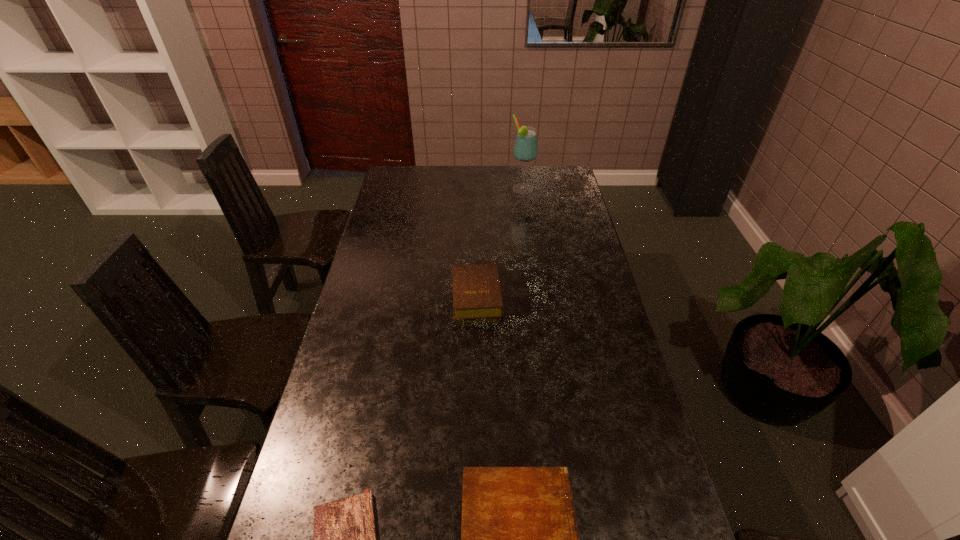
At what (x,y) coordinates should I click in order to perform the action: click on vacant area that lies between the tallest Bible and the farthest object. Please return your answer as a coordinate pair (x, y). Looking at the image, I should click on (499, 242).

Locate an element on the screen. object that stands as the closest to the second shortest object is located at coordinates (344, 534).

In order to click on the closest object to the second farthest object in this screenshot , I will do `click(519, 538)`.

Identify which Bible is the second closest to the shortest Bible. Please provide its 2D coordinates. Your answer should be formatted as a tuple, i.e. [(x, y)], where the tuple contains the x and y coordinates of a point satisfying the conditions above.

[(476, 289)]

Locate an element on the screen. Image resolution: width=960 pixels, height=540 pixels. the closest Bible to the shortest Bible is located at coordinates (519, 538).

Locate an element on the screen. Image resolution: width=960 pixels, height=540 pixels. vacant space that satisfies the following two spatial constraints: 1. on the back side of the second tallest object; 2. on the left side of the alcohol is located at coordinates (477, 190).